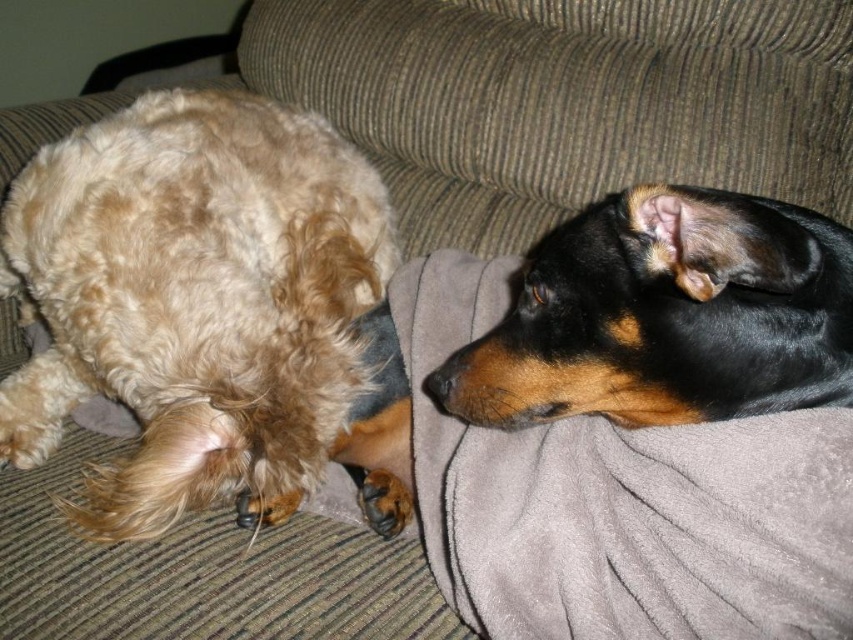
Question: Which object appears closest to the camera in this image?

Choices:
 (A) gray soft blanket at upper center
 (B) fluffy golden fur at left

Answer: (B)

Question: Is fluffy golden fur at left wider than gray soft blanket at upper center?

Choices:
 (A) no
 (B) yes

Answer: (A)

Question: Where is gray soft blanket at upper center located in relation to gray soft blanket at upper right in the image?

Choices:
 (A) left
 (B) right

Answer: (A)

Question: Which object appears closest to the camera in this image?

Choices:
 (A) gray soft blanket at upper right
 (B) black shiny dog at upper right

Answer: (B)

Question: Observing the image, what is the correct spatial positioning of gray soft blanket at upper center in reference to gray soft blanket at upper right?

Choices:
 (A) above
 (B) below

Answer: (A)

Question: Among these points, which one is farthest from the camera?

Choices:
 (A) (253, 106)
 (B) (480, 65)
 (C) (746, 355)
 (D) (505, 282)

Answer: (B)